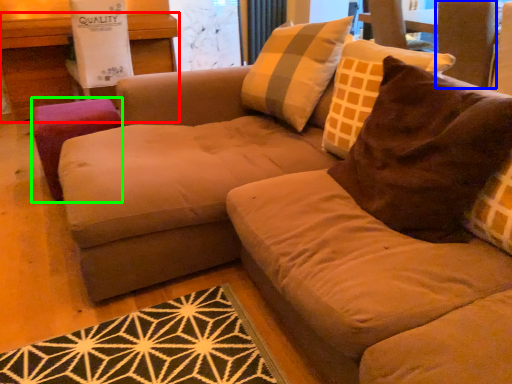
Question: Which object is the closest to the table (highlighted by a red box)? Choose among these: swivel chair (highlighted by a blue box) or stool (highlighted by a green box).

Choices:
 (A) swivel chair
 (B) stool

Answer: (B)